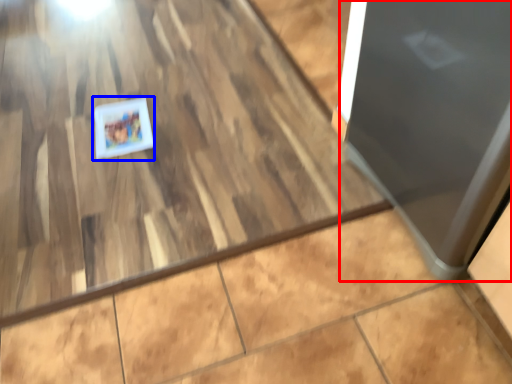
Question: Which object is further to the camera taking this photo, door (highlighted by a red box) or postcard (highlighted by a blue box)?

Choices:
 (A) door
 (B) postcard

Answer: (B)